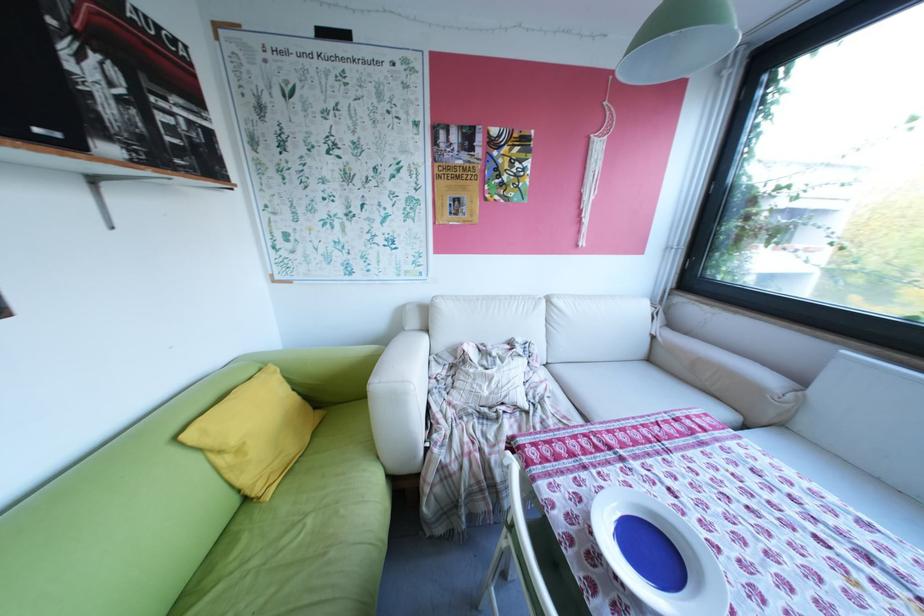
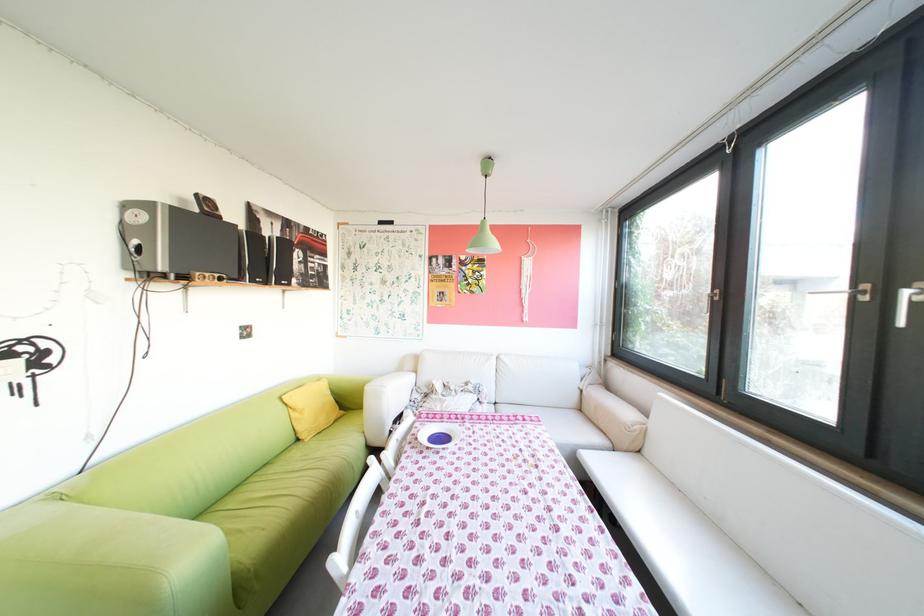
Locate, in the second image, the point that corresponds to (234,451) in the first image.

(307, 410)